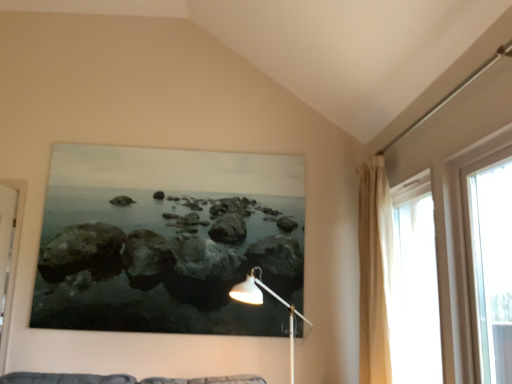
Question: Is transparent glass window at right, which is the first window in front-to-back order, taller or shorter than beige fabric curtain at right?

Choices:
 (A) tall
 (B) short

Answer: (B)

Question: Looking at their shapes, would you say transparent glass window at right, which is the first window in front-to-back order, is wider or thinner than beige fabric curtain at right?

Choices:
 (A) thin
 (B) wide

Answer: (A)

Question: Estimate the real-world distances between objects in this image. Which object is farther from the transparent glass window at right, which is the first window in front-to-back order?

Choices:
 (A) white metal floor lamp at lower center
 (B) translucent fabric curtain at right, the first window in the back-to-front sequence
 (C) beige fabric curtain at right

Answer: (A)

Question: Estimate the real-world distances between objects in this image. Which object is farther from the transparent glass window at right, acting as the second window starting from the back?

Choices:
 (A) beige fabric curtain at right
 (B) translucent fabric curtain at right, the 2th window when ordered from front to back
 (C) white metal floor lamp at lower center

Answer: (C)